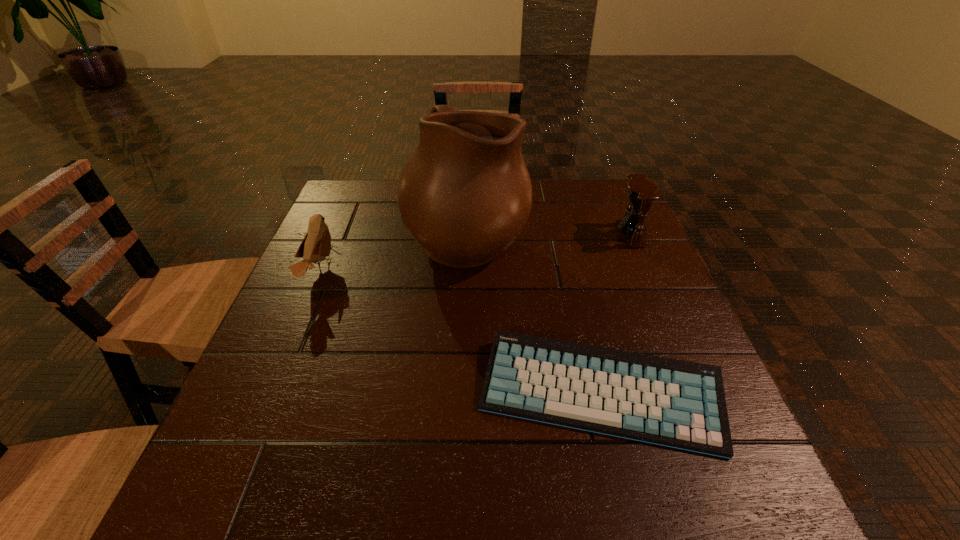
Identify the location of the tallest object. (465, 195).

This screenshot has width=960, height=540. I want to click on hourglass, so click(641, 192).

Identify the location of bird. Image resolution: width=960 pixels, height=540 pixels. (316, 246).

This screenshot has height=540, width=960. Identify the location of the second shortest object. (316, 246).

The image size is (960, 540). I want to click on the shortest object, so click(681, 404).

Find the location of `computer keyboard`. computer keyboard is located at coordinates (681, 404).

This screenshot has width=960, height=540. I want to click on free point located at the spout of the tallest object, so click(x=577, y=237).

Identify the location of free space located 0.290m on the left of the third shortest object. (504, 235).

Identify the location of free region located at the beak of the bird. tap(411, 271).

I want to click on free location located on the left of the nearest object, so click(x=388, y=394).